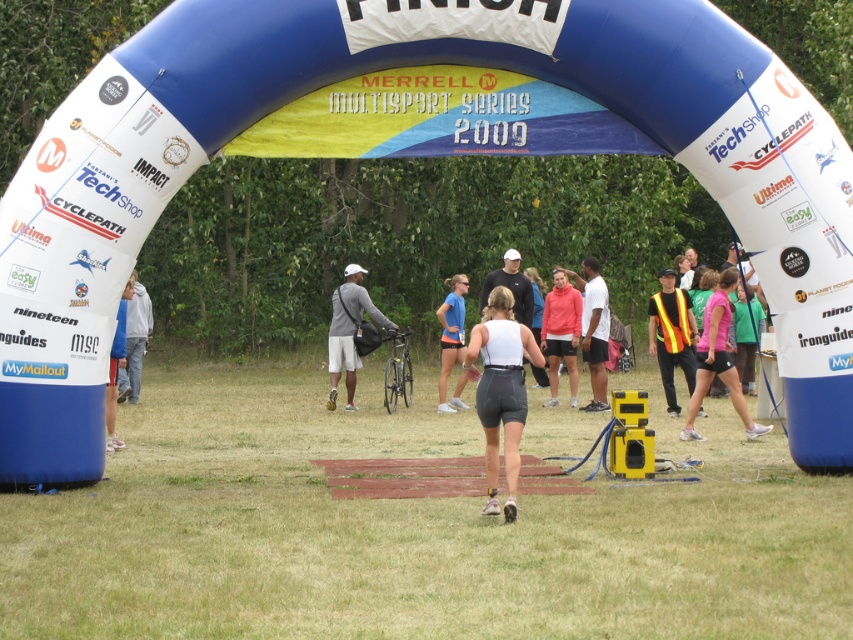
You are a photographer at the finish line of a multisport event in 2009. You notice two participants wearing a white matte tank top at center and a matte pink hoodie at center. Which clothing item is closer to the camera?

The white matte tank top at center is positioned under the matte pink hoodie at center, so it is closer to the camera.

From the picture: You are a photographer at the finish line of a multisport event. You need to capture a closeup shot of the runner wearing both the white matte tank top at center and the matte pink hoodie at center. Which clothing item should you focus on if you want to highlight its slim silhouette?

The white matte tank top at center is thinner than the matte pink hoodie at center, so you should focus on the white matte tank top at center to highlight its slim silhouette.

You are standing at the finish line of a multisport event in 2009. There are two points marked on the ground in front of you. The first point is at coordinates point (471,349) and the second is at point (544,352). Which point is closer to you?

Point (471,349) is closer to the viewer than point (544,352).